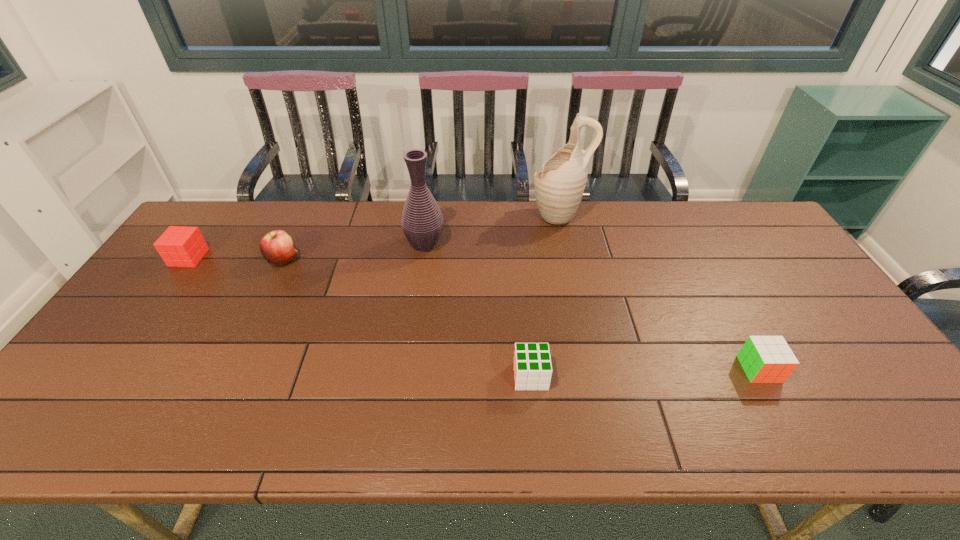
I want to click on free point between the farthest object and the second cube from left to right, so click(x=544, y=296).

Where is `free space between the third object from left to right and the pitcher`? This screenshot has height=540, width=960. free space between the third object from left to right and the pitcher is located at coordinates (492, 230).

This screenshot has height=540, width=960. In order to click on free space between the rightmost cube and the farthest object in this screenshot , I will do click(x=659, y=292).

Identify the location of vacant space in between the rightmost object and the second object from right to left. (659, 292).

Where is `vacant space in between the rightmost cube and the pitcher`? This screenshot has width=960, height=540. vacant space in between the rightmost cube and the pitcher is located at coordinates (659, 292).

This screenshot has width=960, height=540. Find the location of `unoccupied area between the rightmost object and the farthest cube`. unoccupied area between the rightmost object and the farthest cube is located at coordinates (474, 313).

Choose which object is the third nearest neighbor to the farthest cube. Please provide its 2D coordinates. Your answer should be formatted as a tuple, i.e. [(x, y)], where the tuple contains the x and y coordinates of a point satisfying the conditions above.

[(532, 365)]

Choose which object is the fifth nearest neighbor to the second object from right to left. Please provide its 2D coordinates. Your answer should be formatted as a tuple, i.e. [(x, y)], where the tuple contains the x and y coordinates of a point satisfying the conditions above.

[(180, 246)]

Choose which cube is the second nearest neighbor to the rightmost cube. Please provide its 2D coordinates. Your answer should be formatted as a tuple, i.e. [(x, y)], where the tuple contains the x and y coordinates of a point satisfying the conditions above.

[(180, 246)]

Locate an element on the screen. The image size is (960, 540). cube identified as the second closest to the fifth object from right to left is located at coordinates (532, 365).